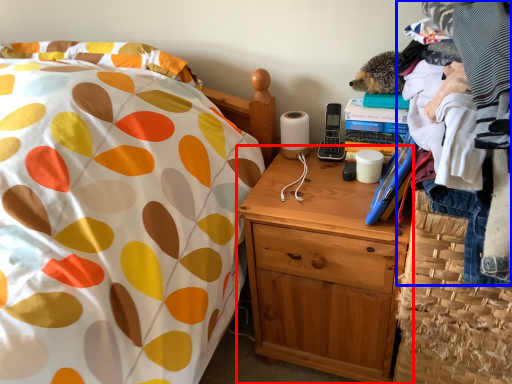
Question: Which of the following is the closest to the observer, nightstand (highlighted by a red box) or clothing (highlighted by a blue box)?

Choices:
 (A) nightstand
 (B) clothing

Answer: (B)